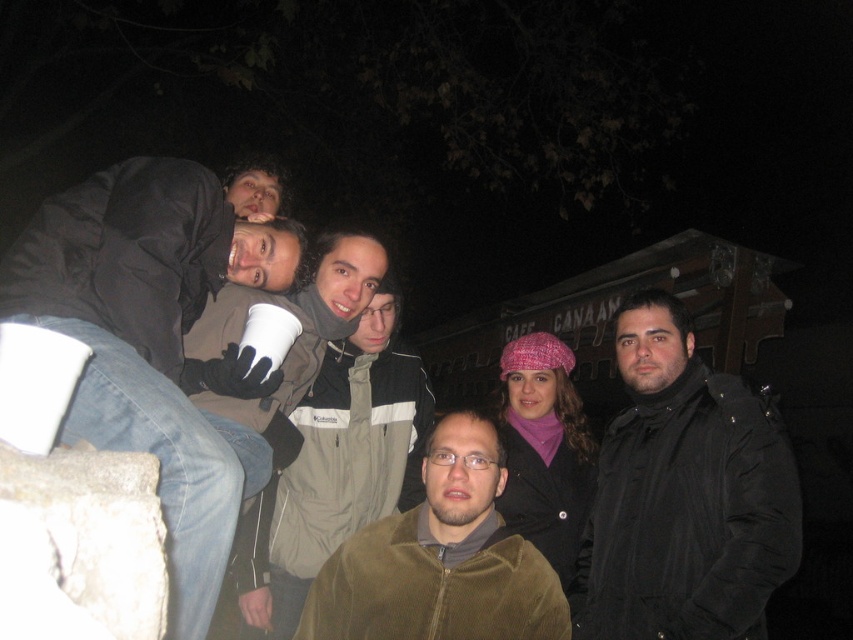
Question: Based on their relative distances, which object is farther from the corduroy jacket at center?

Choices:
 (A) white paper cup at upper left
 (B) khaki corduroy jacket at center

Answer: (B)

Question: Can you confirm if white paper cup at upper left is bigger than corduroy jacket at center?

Choices:
 (A) no
 (B) yes

Answer: (B)

Question: Which point is closer to the camera taking this photo?

Choices:
 (A) (786, 486)
 (B) (515, 620)
 (C) (310, 577)
 (D) (90, 227)

Answer: (D)

Question: Is white paper cup at upper left below corduroy jacket at center?

Choices:
 (A) no
 (B) yes

Answer: (A)

Question: Can you confirm if black matte jacket at center is wider than corduroy jacket at center?

Choices:
 (A) yes
 (B) no

Answer: (B)

Question: Which point is closer to the camera?

Choices:
 (A) white paper cup at upper left
 (B) khaki corduroy jacket at center
 (C) black matte jacket at center
 (D) corduroy jacket at center

Answer: (A)